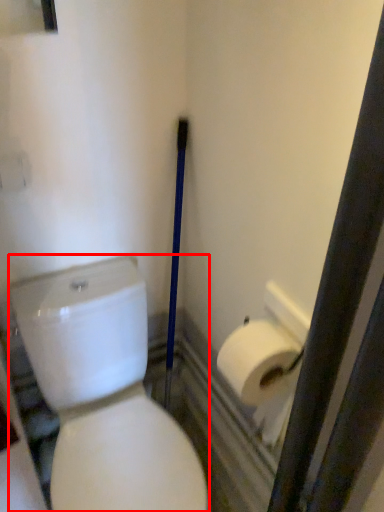
Question: From the image's perspective, considering the relative positions of porcelain (annotated by the red box) and toilet paper in the image provided, where is porcelain (annotated by the red box) located with respect to the staircase?

Choices:
 (A) above
 (B) below

Answer: (B)